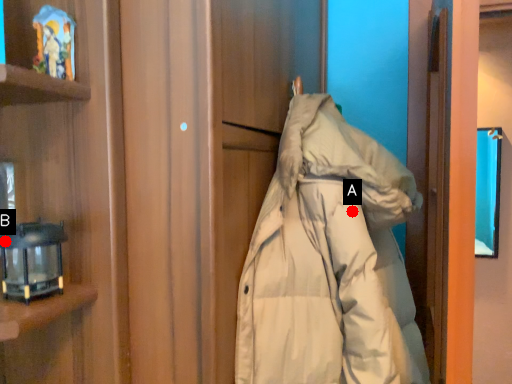
Question: Two points are circled on the image, labeled by A and B beside each circle. Among these points, which one is nearest to the camera?

Choices:
 (A) A is closer
 (B) B is closer

Answer: (B)